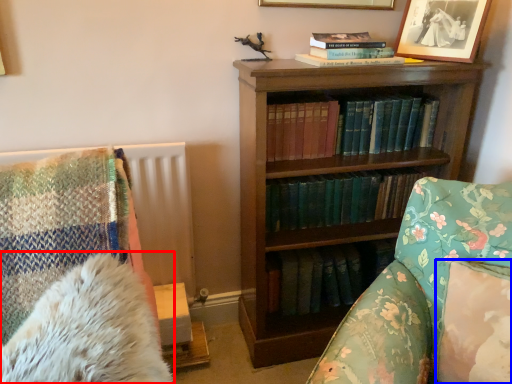
Question: Which object is closer to the camera taking this photo, chiffonier (highlighted by a red box) or pillow (highlighted by a blue box)?

Choices:
 (A) chiffonier
 (B) pillow

Answer: (A)